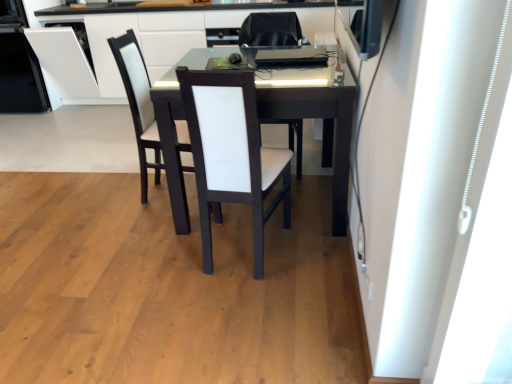
Question: Is white glossy dishwasher at left bigger than white matte curtain at right?

Choices:
 (A) no
 (B) yes

Answer: (B)

Question: Does white glossy dishwasher at left turn towards white matte curtain at right?

Choices:
 (A) no
 (B) yes

Answer: (A)

Question: Is white glossy dishwasher at left shorter than white matte curtain at right?

Choices:
 (A) no
 (B) yes

Answer: (B)

Question: Is white glossy dishwasher at left not near white matte curtain at right?

Choices:
 (A) no
 (B) yes

Answer: (B)

Question: Is white glossy dishwasher at left not within white matte curtain at right?

Choices:
 (A) yes
 (B) no

Answer: (A)

Question: From the image's perspective, is white glossy dishwasher at left beneath white matte curtain at right?

Choices:
 (A) no
 (B) yes

Answer: (A)

Question: Does white leather chair at center, acting as the second chair starting from the front, have a greater height compared to white leather chair at center, acting as the second chair starting from the back?

Choices:
 (A) yes
 (B) no

Answer: (B)

Question: Is white leather chair at center, acting as the second chair starting from the front, to the right of white leather chair at center, the first chair in the front-to-back sequence, from the viewer's perspective?

Choices:
 (A) yes
 (B) no

Answer: (A)

Question: Is white leather chair at center, which is the first chair from back to front, aimed at white leather chair at center, the first chair in the front-to-back sequence?

Choices:
 (A) yes
 (B) no

Answer: (B)

Question: Is white leather chair at center, acting as the second chair starting from the front, oriented away from white leather chair at center, acting as the second chair starting from the back?

Choices:
 (A) no
 (B) yes

Answer: (A)

Question: Does white leather chair at center, acting as the second chair starting from the front, have a lesser height compared to white leather chair at center, the first chair in the front-to-back sequence?

Choices:
 (A) no
 (B) yes

Answer: (B)

Question: Does white leather chair at center, acting as the second chair starting from the front, have a larger size compared to white leather chair at center, the first chair in the front-to-back sequence?

Choices:
 (A) yes
 (B) no

Answer: (A)

Question: Is white leather chair at center a part of white leather chair at center, the first chair in the front-to-back sequence?

Choices:
 (A) no
 (B) yes

Answer: (A)